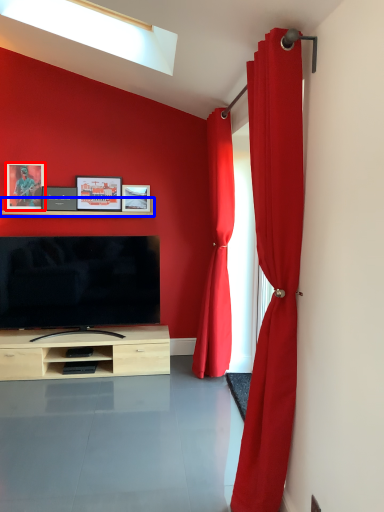
Question: Which of the following is the closest to the observer, picture frame (highlighted by a red box) or shelf (highlighted by a blue box)?

Choices:
 (A) picture frame
 (B) shelf

Answer: (B)